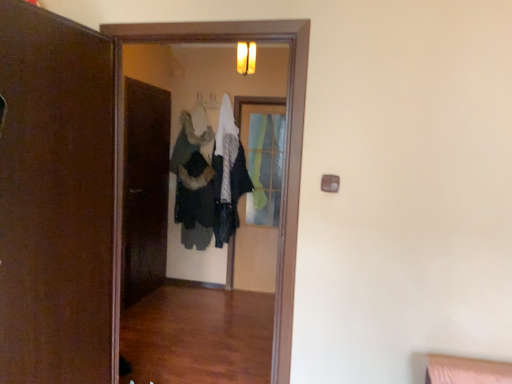
Question: Does dark gray fabric coat at center have a lesser width compared to brown matte door at left?

Choices:
 (A) no
 (B) yes

Answer: (A)

Question: Is dark gray fabric coat at center not within brown matte door at left?

Choices:
 (A) no
 (B) yes

Answer: (B)

Question: Are dark gray fabric coat at center and brown matte door at left located far from each other?

Choices:
 (A) no
 (B) yes

Answer: (B)

Question: Are dark gray fabric coat at center and brown matte door at left making contact?

Choices:
 (A) no
 (B) yes

Answer: (A)

Question: Is dark gray fabric coat at center in front of brown matte door at left?

Choices:
 (A) no
 (B) yes

Answer: (A)

Question: Considering the relative positions of dark gray fabric coat at center and brown matte door at left in the image provided, is dark gray fabric coat at center to the right of brown matte door at left from the viewer's perspective?

Choices:
 (A) no
 (B) yes

Answer: (B)

Question: Is clear glass screen door at center, positioned as the 1th screen door in back-to-front order, wider than wooden screen door at center, the first screen door viewed from the front?

Choices:
 (A) yes
 (B) no

Answer: (B)

Question: Is clear glass screen door at center, positioned as the 1th screen door in back-to-front order, thinner than wooden screen door at center, the 2th screen door viewed from the back?

Choices:
 (A) no
 (B) yes

Answer: (B)

Question: Is clear glass screen door at center, which appears as the second screen door when viewed from the front, aimed at wooden screen door at center, the 2th screen door viewed from the back?

Choices:
 (A) no
 (B) yes

Answer: (B)

Question: Are clear glass screen door at center, positioned as the 1th screen door in back-to-front order, and wooden screen door at center, the first screen door viewed from the front, far apart?

Choices:
 (A) no
 (B) yes

Answer: (B)

Question: Is clear glass screen door at center, which appears as the second screen door when viewed from the front, facing away from wooden screen door at center, the 2th screen door viewed from the back?

Choices:
 (A) no
 (B) yes

Answer: (A)

Question: Can you confirm if clear glass screen door at center, positioned as the 1th screen door in back-to-front order, is bigger than wooden screen door at center, the 2th screen door viewed from the back?

Choices:
 (A) no
 (B) yes

Answer: (A)

Question: Does clear glass screen door at center, which appears as the second screen door when viewed from the front, appear on the left side of brown matte door at left?

Choices:
 (A) no
 (B) yes

Answer: (A)